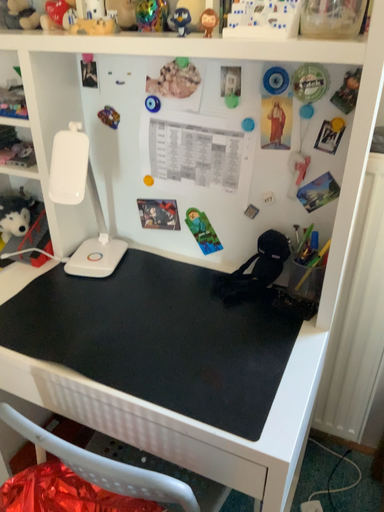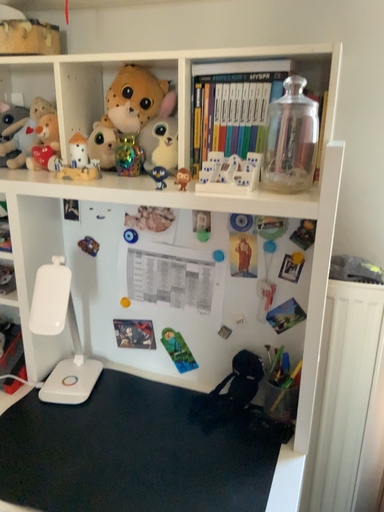
Question: Which way did the camera rotate in the video?

Choices:
 (A) rotated downward
 (B) rotated upward

Answer: (B)